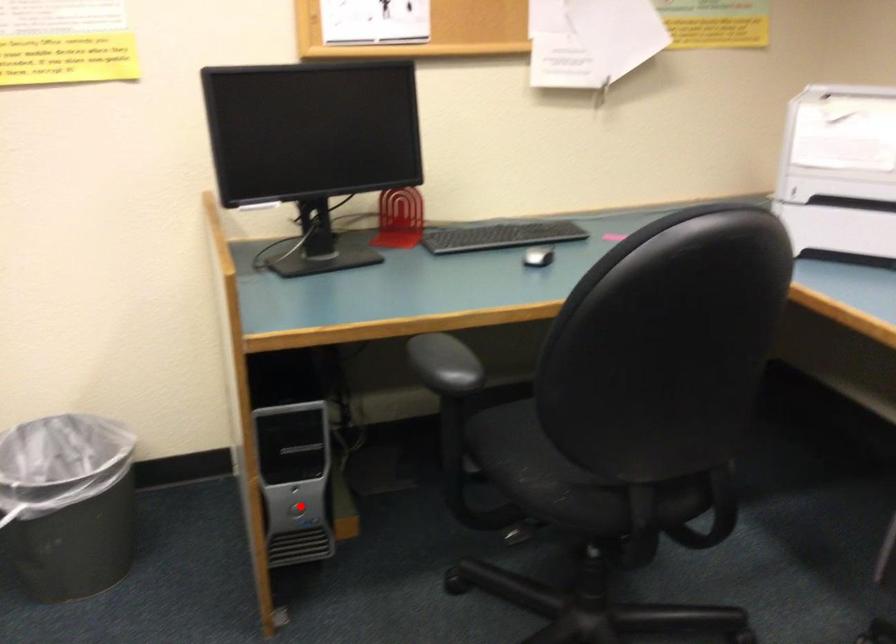
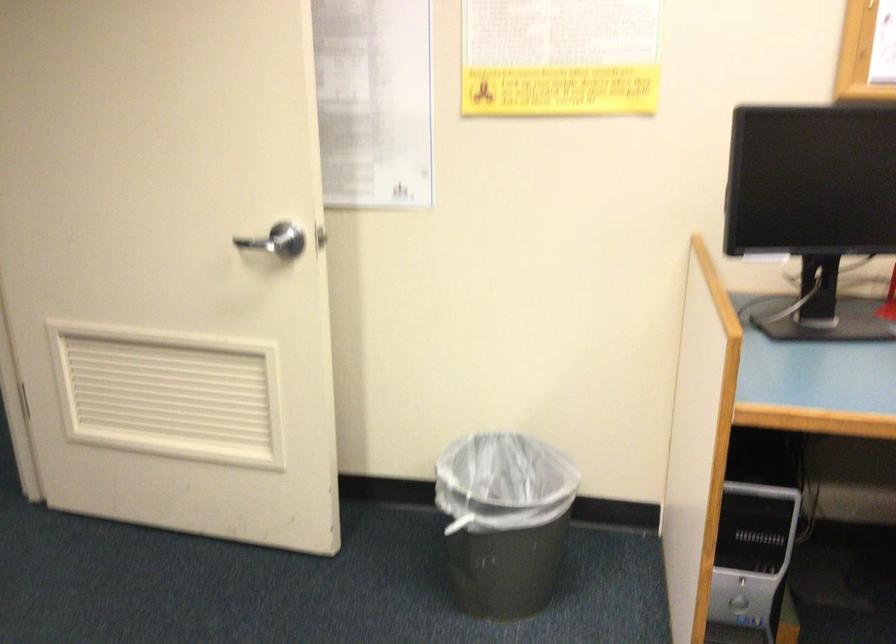
Find the pixel in the second image that matches the highlighted location in the first image.

(737, 601)